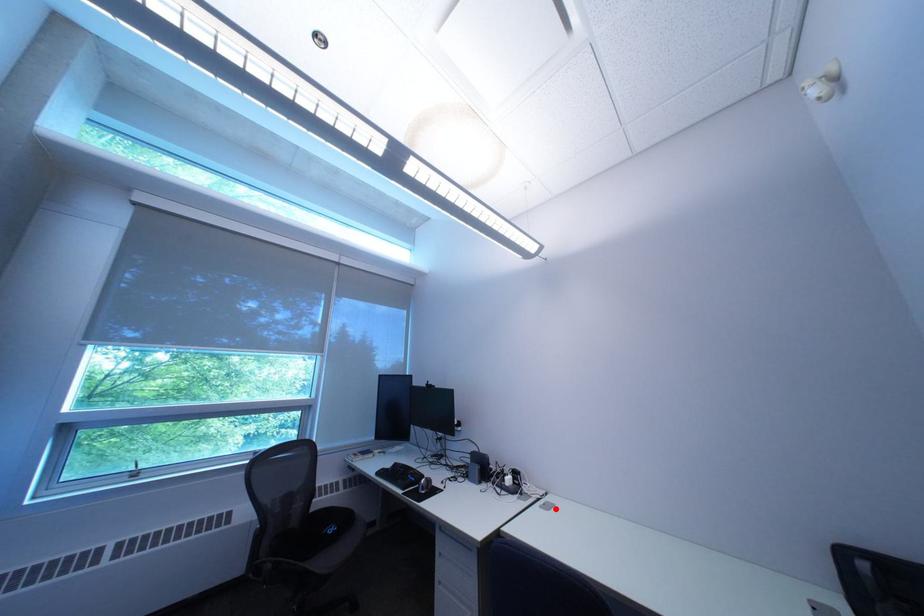
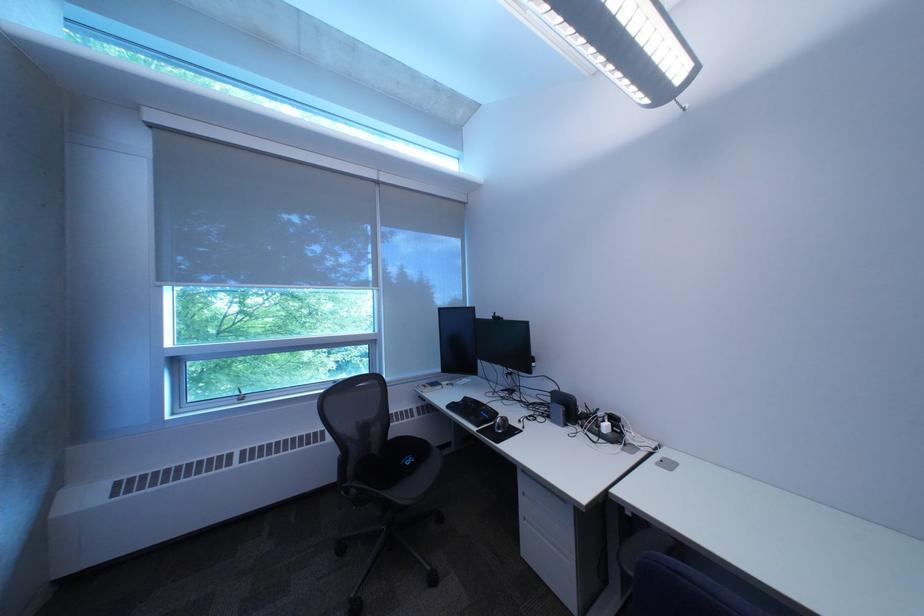
Locate, in the second image, the point that corresponds to the highlighted location in the first image.

(673, 466)